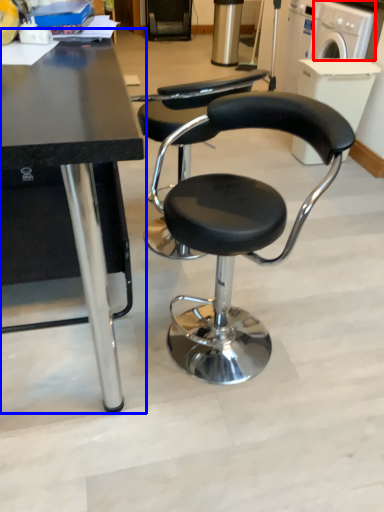
Question: Which point is further to the camera, washing machine (highlighted by a red box) or table (highlighted by a blue box)?

Choices:
 (A) washing machine
 (B) table

Answer: (A)